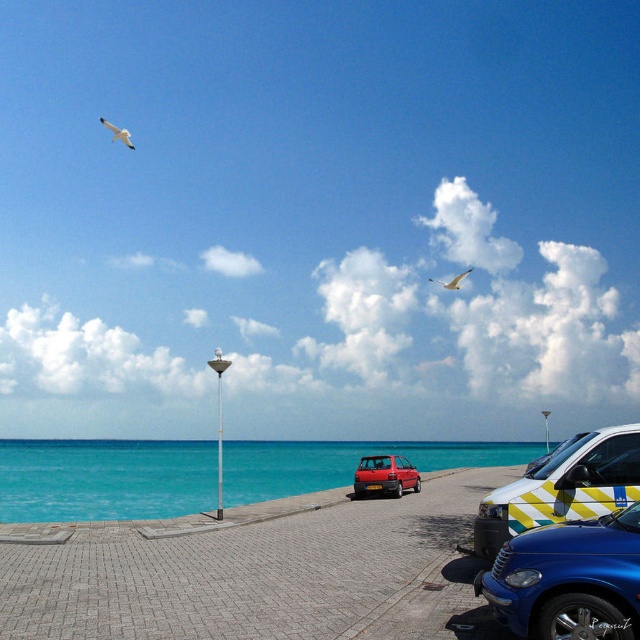
Question: In this image, where is turquoise glossy water at lower left located relative to white feathered bird at upper center?

Choices:
 (A) above
 (B) below

Answer: (B)

Question: Considering the real-world distances, which object is closest to the matte red car at center?

Choices:
 (A) blue glossy car at lower right
 (B) white feathered bird at upper left
 (C) turquoise glossy water at lower left
 (D) white feathered bird at upper center

Answer: (A)

Question: Does turquoise glossy water at lower left appear on the right side of yellow and white striped ambulance at lower right?

Choices:
 (A) yes
 (B) no

Answer: (B)

Question: Considering the real-world distances, which object is closest to the matte red car at center?

Choices:
 (A) yellow and white striped ambulance at lower right
 (B) white feathered bird at upper center
 (C) turquoise glossy water at lower left

Answer: (A)

Question: Which point is farther to the camera?

Choices:
 (A) (234, 486)
 (B) (376, 486)

Answer: (A)

Question: Observing the image, what is the correct spatial positioning of blue glossy car at lower right in reference to white feathered bird at upper center?

Choices:
 (A) below
 (B) above

Answer: (A)